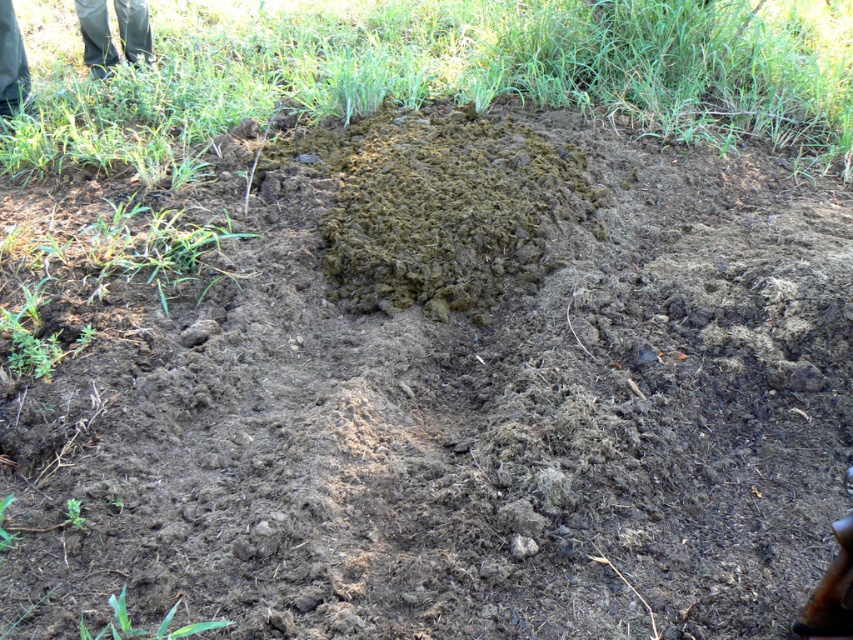
From the picture: Between brown soil mound at center and green rubber boots at upper left, which one is positioned higher?

green rubber boots at upper left is above.

What do you see at coordinates (442, 205) in the screenshot? This screenshot has width=853, height=640. I see `brown soil mound at center` at bounding box center [442, 205].

Is point (476, 195) positioned after point (144, 29)?

That is False.

At what (x,y) coordinates should I click in order to perform the action: click on brown soil mound at center. Please return your answer as a coordinate pair (x, y). The image size is (853, 640). Looking at the image, I should click on (442, 205).